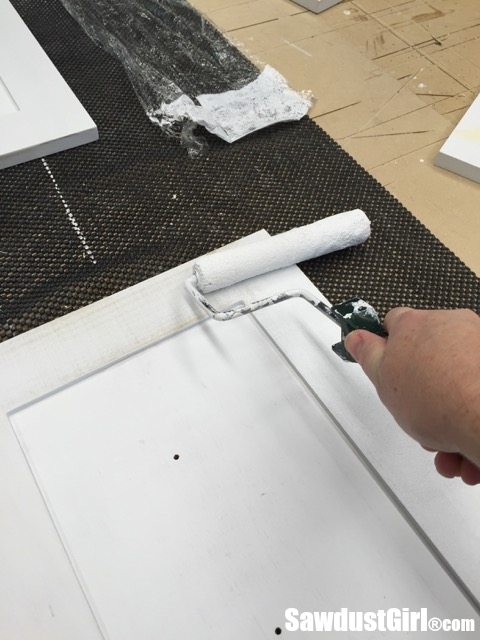
You are a GUI agent. You are given a task and a screenshot of the screen. Output one action in this format:
    pyautogui.click(x=<x>, y=<y>)
    Task: Click on the other door
    The height and width of the screenshot is (640, 480).
    Given the screenshot: What is the action you would take?
    pyautogui.click(x=47, y=127)